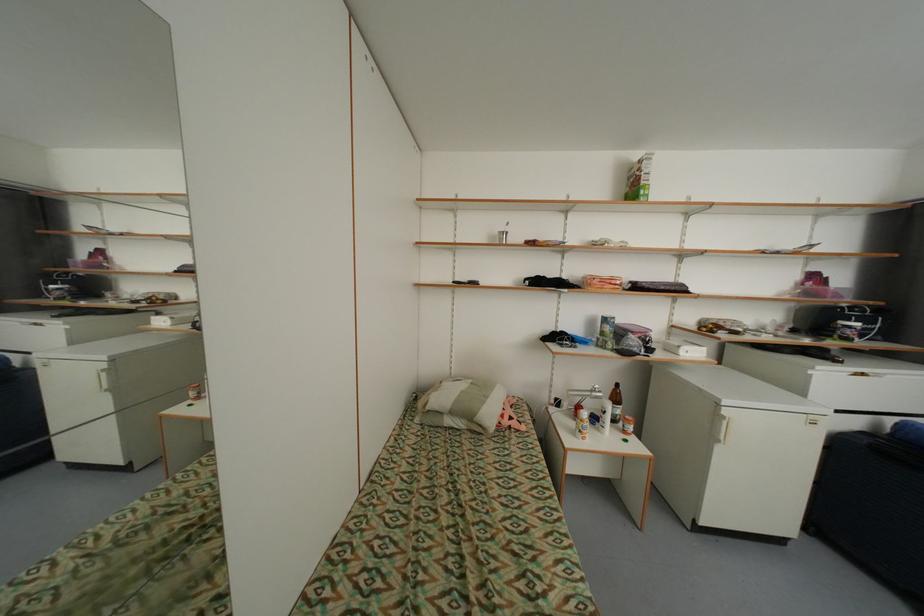
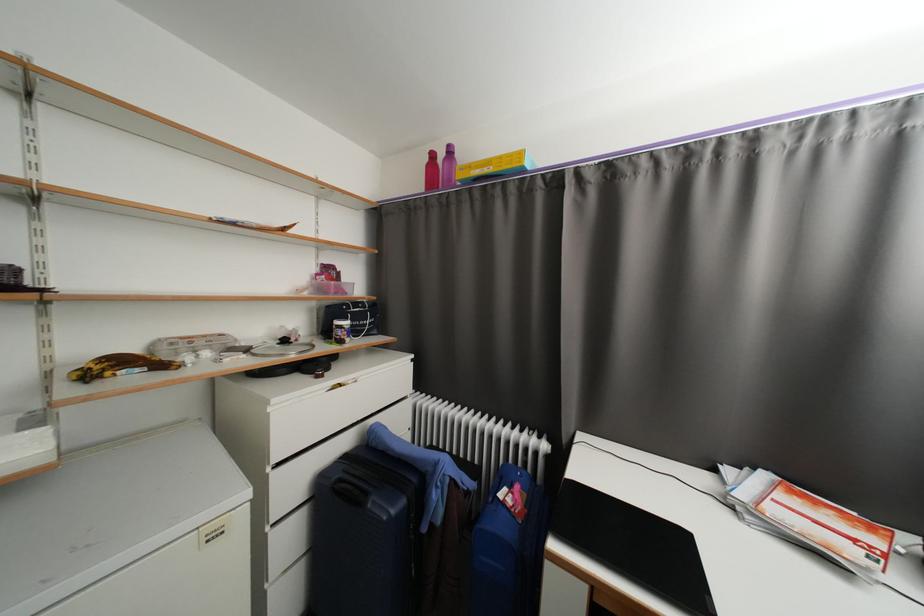
Where in the second image is the point corresponding to [800,331] from the first image?

(290, 342)